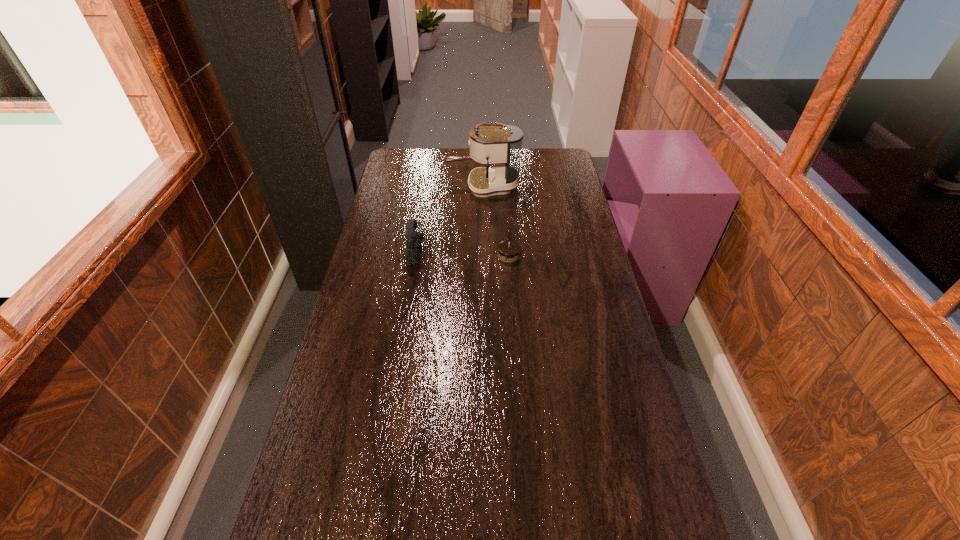
At what (x,y) coordinates should I click in order to perform the action: click on the farthest object. Please return your answer as a coordinate pair (x, y). Looking at the image, I should click on (501, 145).

Locate an element on the screen. The height and width of the screenshot is (540, 960). coffee maker is located at coordinates (501, 145).

The height and width of the screenshot is (540, 960). Identify the location of the leftmost object. (413, 239).

At what (x,y) coordinates should I click in order to perform the action: click on the second shortest object. Please return your answer as a coordinate pair (x, y). Looking at the image, I should click on (413, 239).

Find the location of a particular element. The width and height of the screenshot is (960, 540). the shortest object is located at coordinates (508, 251).

I want to click on vacant space located on the front-facing side of the coffee maker, so click(428, 187).

Where is `vacant point located 0.160m on the front-facing side of the coffee maker`? The height and width of the screenshot is (540, 960). vacant point located 0.160m on the front-facing side of the coffee maker is located at coordinates (412, 187).

Where is `vacant space situated 0.120m on the front-facing side of the coffee maker`? This screenshot has width=960, height=540. vacant space situated 0.120m on the front-facing side of the coffee maker is located at coordinates (421, 187).

The height and width of the screenshot is (540, 960). What are the coordinates of `vacant region located on the headband of the headset` in the screenshot? It's located at (487, 254).

The image size is (960, 540). In order to click on vacant space located 0.200m on the right of the shortest object in this screenshot , I will do `click(573, 255)`.